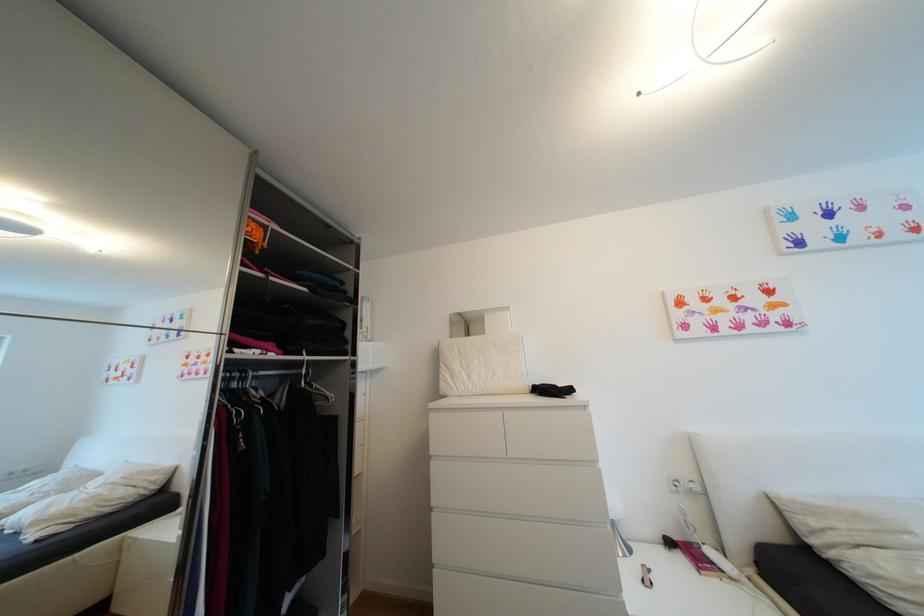
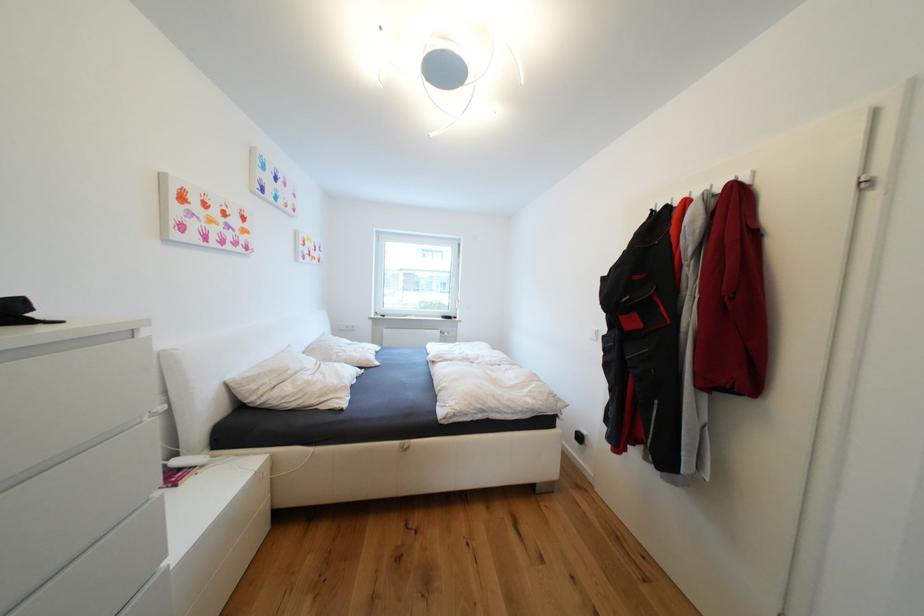
Where in the second image is the point corresponding to pixel 716 554 from the first image?

(184, 464)